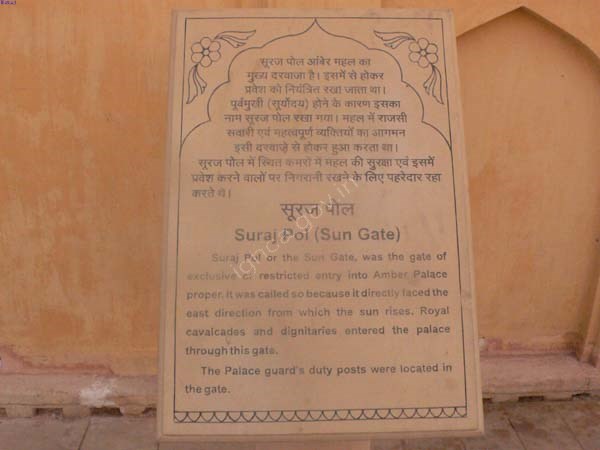
At what (x,y) coordinates should I click in order to perform the action: click on plaque is leaning back against the wall. Please return your answer as a coordinate pair (x, y). Looking at the image, I should click on (322, 151).